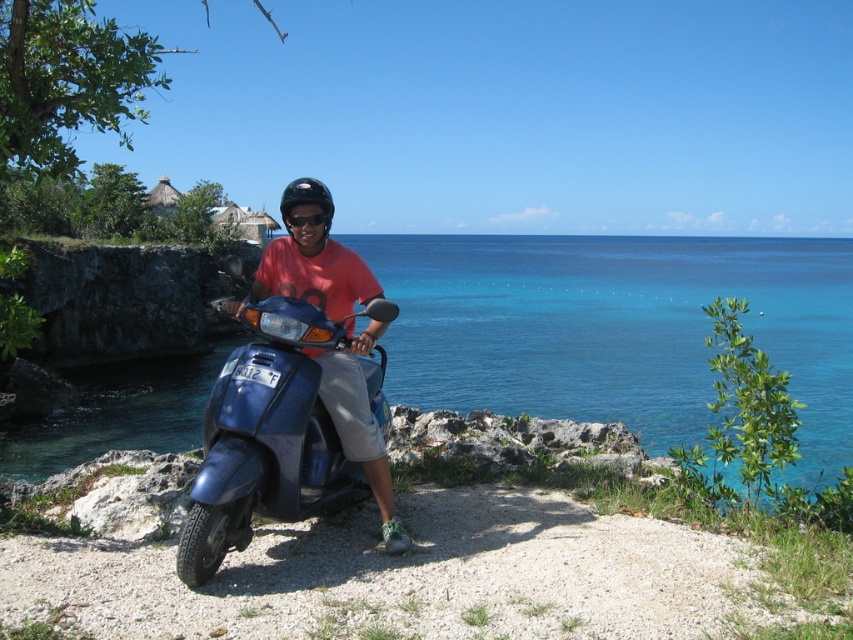
Question: Can you confirm if blue glossy water at center is positioned below black plastic goggles at center?

Choices:
 (A) yes
 (B) no

Answer: (B)

Question: Which object appears closest to the camera in this image?

Choices:
 (A) black plastic goggles at center
 (B) blue glossy water at center
 (C) matte blue scooter at center

Answer: (C)

Question: Is blue glossy water at center in front of black plastic goggles at center?

Choices:
 (A) yes
 (B) no

Answer: (B)

Question: Observing the image, what is the correct spatial positioning of blue glossy water at center in reference to black plastic goggles at center?

Choices:
 (A) above
 (B) below

Answer: (A)

Question: Which of these objects is positioned closest to the black plastic goggles at center?

Choices:
 (A) blue glossy water at center
 (B) matte blue scooter at center

Answer: (B)

Question: Among these points, which one is farthest from the camera?

Choices:
 (A) (326, 230)
 (B) (164, 360)

Answer: (B)